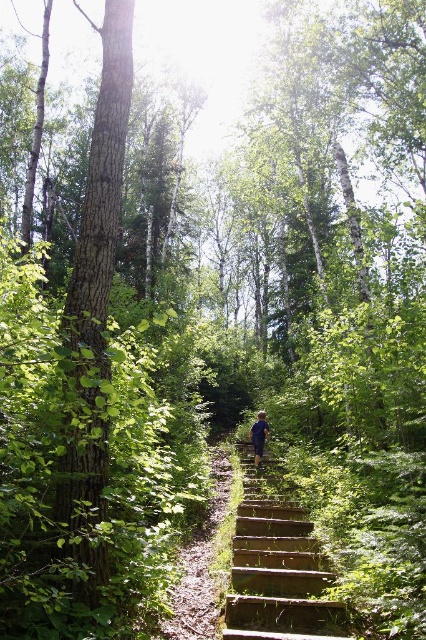
You are a hiker planning to climb the wooden stairs at center. There is a green rough bark tree at left nearby. Which object takes up more space in the image?

The green rough bark tree at left has a larger size compared to wooden stairs at center, so it takes up more space in the image.

You are a hiker trying to determine the best path upwards. You notice the green rough bark tree at left and the wooden stairs at center. Which object is taller and would provide a better vantage point?

The green rough bark tree at left is taller than the wooden stairs at center, so climbing it would provide a better vantage point.

You are a hiker standing at the bottom of the wooden stairs. You want to take a photo of the blue fabric hiker at center and the green rough bark tree at left. Which object should you focus on first to ensure both are in the frame?

You should focus on the green rough bark tree at left first because it is closer to you than the blue fabric hiker at center, ensuring both are in the frame.